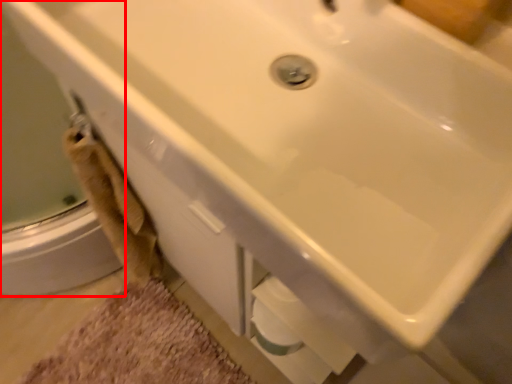
Question: From the image's perspective, what is the correct spatial positioning of shower door (annotated by the red box) in reference to bath mat?

Choices:
 (A) above
 (B) below

Answer: (A)